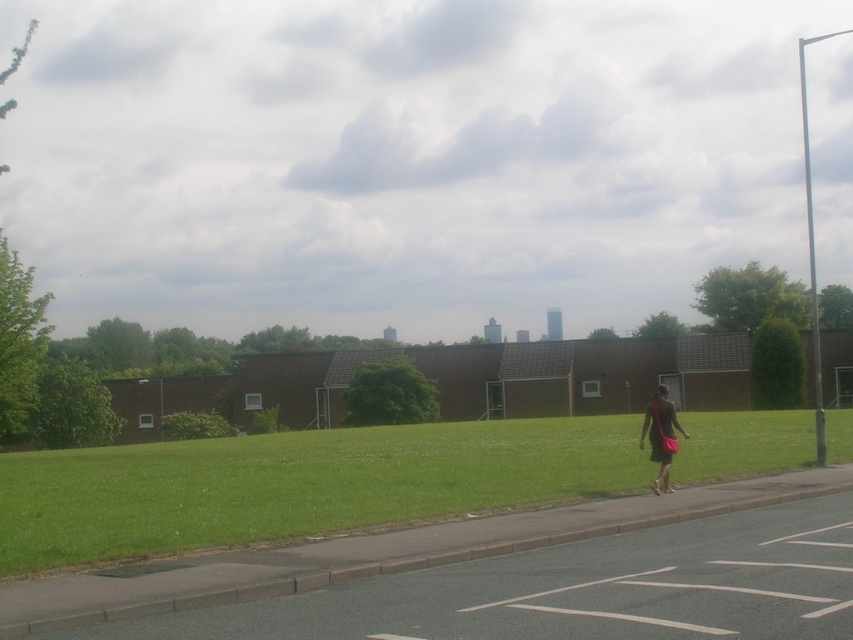
Question: Observing the image, what is the correct spatial positioning of green grass at lower center in reference to dark brown fabric dress at center-right?

Choices:
 (A) left
 (B) right

Answer: (A)

Question: Does green grass at lower center lie behind dark brown fabric dress at center-right?

Choices:
 (A) yes
 (B) no

Answer: (B)

Question: Can you confirm if green grass at lower center is positioned to the left of dark brown fabric dress at center-right?

Choices:
 (A) yes
 (B) no

Answer: (A)

Question: Which of the following is the closest to the observer?

Choices:
 (A) green grass at lower center
 (B) dark brown fabric dress at center-right

Answer: (A)